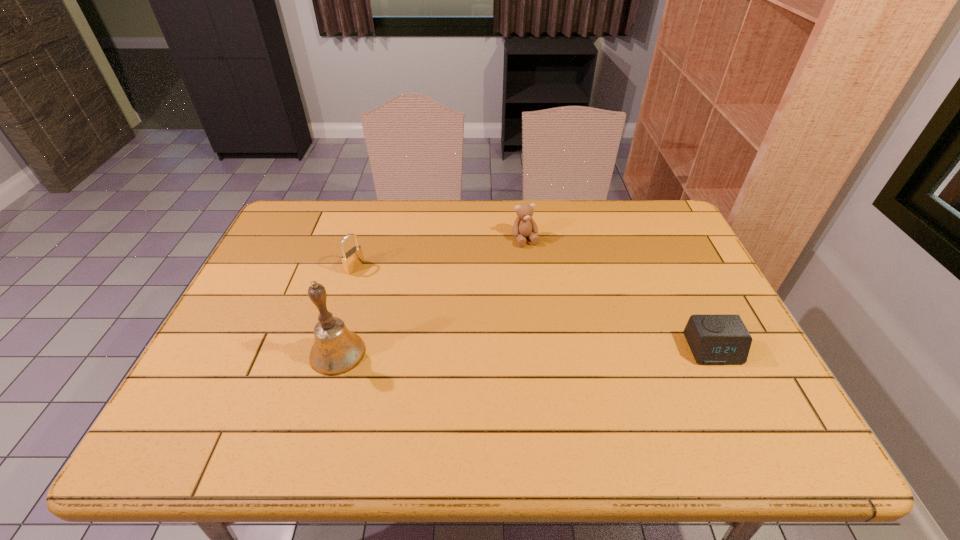
In the image, there is a desktop. What are the coordinates of `free space at the far left corner` in the screenshot? It's located at (314, 220).

At what (x,y) coordinates should I click in order to perform the action: click on vacant region at the near left corner of the desktop. Please return your answer as a coordinate pair (x, y). Looking at the image, I should click on (243, 390).

Locate an element on the screen. vacant space at the far right corner of the desktop is located at coordinates (673, 218).

You are a GUI agent. You are given a task and a screenshot of the screen. Output one action in this format:
    pyautogui.click(x=<x>, y=<y>)
    Task: Click on the vacant area at the near right corner
    The width and height of the screenshot is (960, 540).
    Given the screenshot: What is the action you would take?
    pyautogui.click(x=763, y=400)

Image resolution: width=960 pixels, height=540 pixels. I want to click on free spot between the farthest object and the tallest object, so click(431, 296).

Image resolution: width=960 pixels, height=540 pixels. Identify the location of blank region between the tallest object and the rightmost object. (525, 351).

Image resolution: width=960 pixels, height=540 pixels. I want to click on vacant space that is in between the alarm clock and the bell, so click(x=525, y=351).

Where is `vacant space that is in between the third nearest object and the rightmost object`? vacant space that is in between the third nearest object and the rightmost object is located at coordinates click(x=534, y=308).

Locate an element on the screen. The width and height of the screenshot is (960, 540). free area in between the tallest object and the farthest object is located at coordinates point(431,296).

At what (x,y) coordinates should I click in order to perform the action: click on free space between the rightmost object and the farthest object. Please return your answer as a coordinate pair (x, y). Looking at the image, I should click on (618, 294).